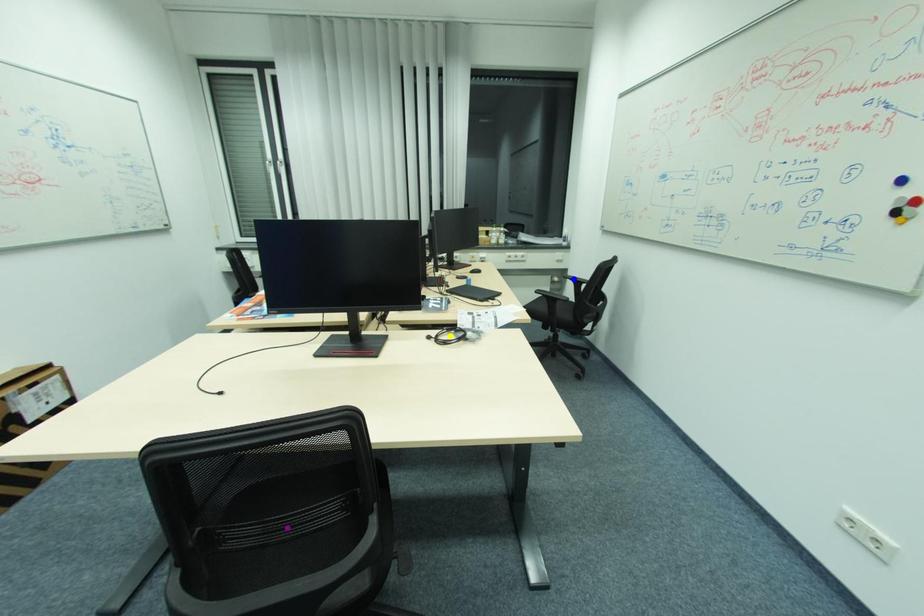
Order these from nearest to farthest:
purple point | yellow point | blue point

purple point < yellow point < blue point